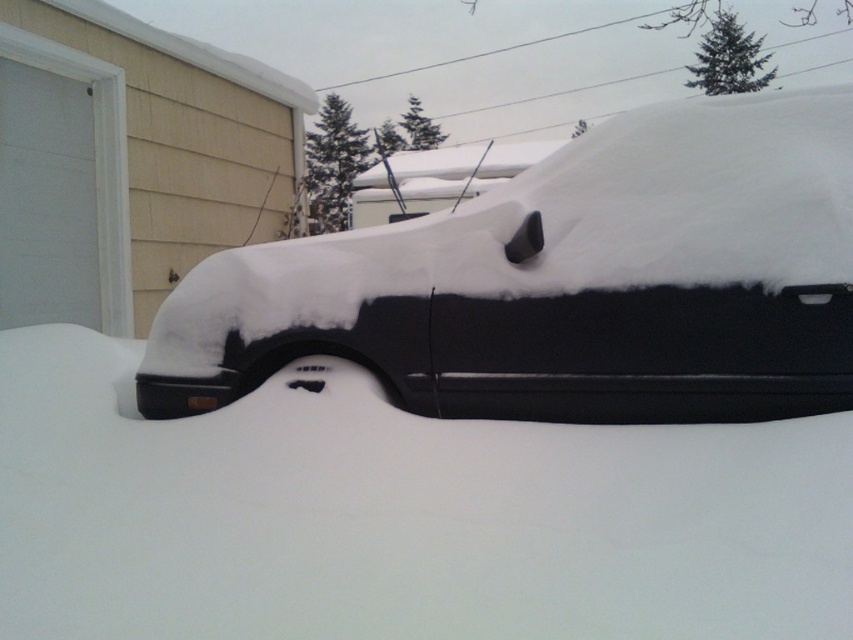
Which is above, white fluffy snow at center or black matte van at center?

black matte van at center

Is point (204, 605) behind point (421, 336)?

No, (204, 605) is closer to viewer.

Locate an element on the screen. This screenshot has width=853, height=640. white fluffy snow at center is located at coordinates coord(398,515).